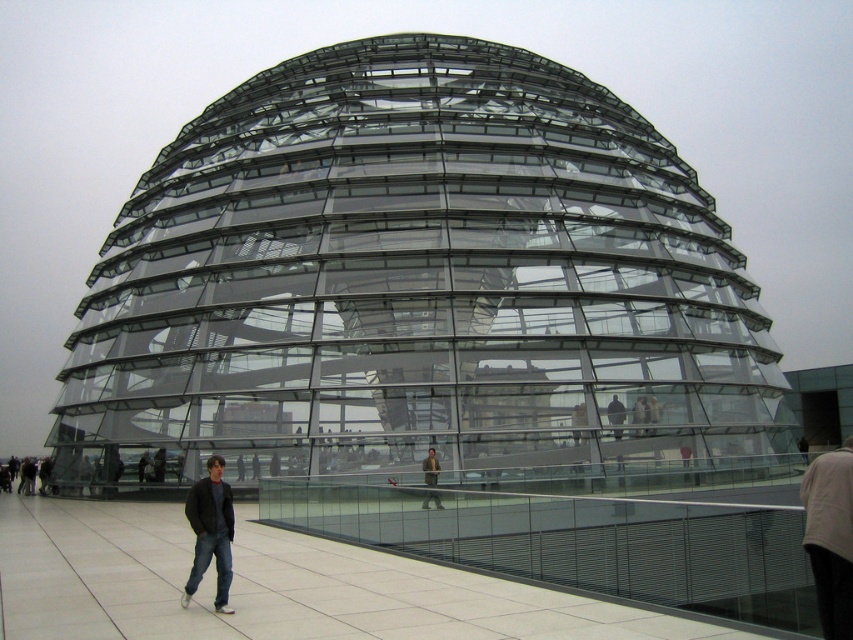
Question: Which of these objects is positioned farthest from the khaki fabric jacket at center?

Choices:
 (A) white cotton shirt at lower right
 (B) dark blue jeans at lower left
 (C) dark gray jacket at center

Answer: (C)

Question: Is transparent glass dome at center bigger than dark gray jacket at center?

Choices:
 (A) yes
 (B) no

Answer: (A)

Question: From the image, what is the correct spatial relationship of dark blue jeans at lower left in relation to dark gray fabric jacket at center?

Choices:
 (A) left
 (B) right

Answer: (A)

Question: Which of the following is the farthest from the observer?

Choices:
 (A) khaki fabric jacket at center
 (B) transparent glass dome at center
 (C) dark gray fabric jacket at center

Answer: (C)

Question: Is white cotton shirt at lower right positioned in front of dark gray fabric jacket at center?

Choices:
 (A) no
 (B) yes

Answer: (B)

Question: Which point is closer to the camera taking this photo?

Choices:
 (A) (622, 413)
 (B) (457, 264)
 (C) (212, 525)
 (D) (433, 492)

Answer: (C)